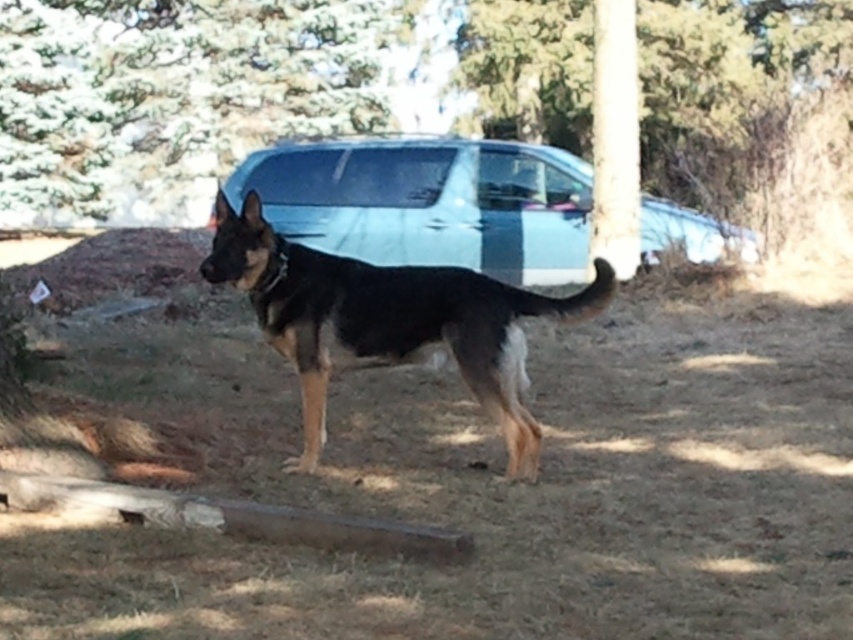
This screenshot has height=640, width=853. What do you see at coordinates (173, 86) in the screenshot?
I see `smooth bark tree at center` at bounding box center [173, 86].

Does smooth bark tree at center appear on the right side of black glossy dog at center?

Incorrect, smooth bark tree at center is not on the right side of black glossy dog at center.

Which is behind, point (392, 33) or point (399, 340)?

Positioned behind is point (392, 33).

The image size is (853, 640). What are the coordinates of `smooth bark tree at center` in the screenshot? It's located at [173, 86].

This screenshot has width=853, height=640. Describe the element at coordinates (173, 86) in the screenshot. I see `smooth bark tree at center` at that location.

Does smooth bark tree at center have a larger size compared to satin silver car at center?

Yes.

Is point (32, 177) behind point (518, 193)?

Yes.

Find the location of a particular element. The height and width of the screenshot is (640, 853). smooth bark tree at center is located at coordinates (173, 86).

Is green textured tree at upper left below black glossy dog at center?

Incorrect, green textured tree at upper left is not positioned below black glossy dog at center.

Does green textured tree at upper left come behind black glossy dog at center?

Yes, green textured tree at upper left is behind black glossy dog at center.

In order to click on green textured tree at upper left in this screenshot , I will do `click(173, 93)`.